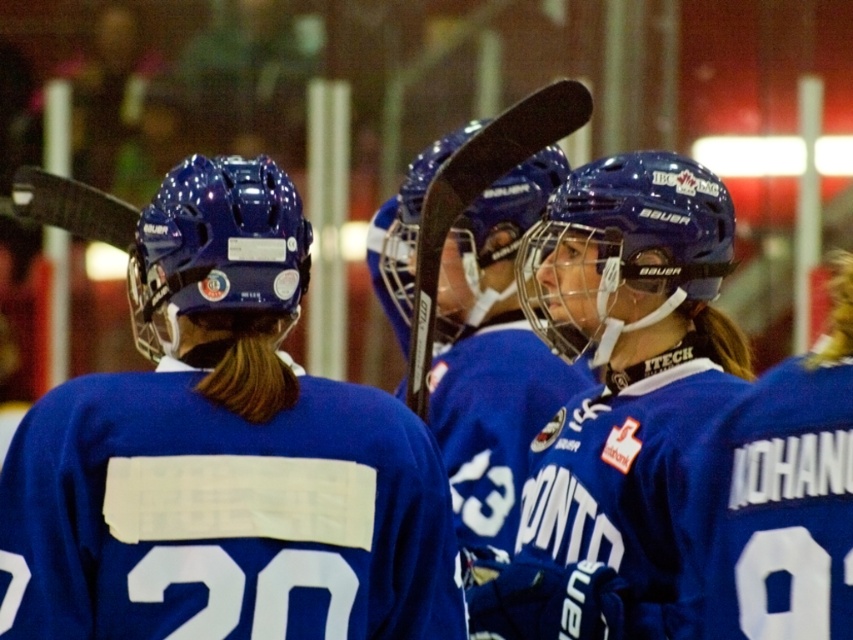
Question: Which object is farther from the camera taking this photo?

Choices:
 (A) matte blue jersey at center
 (B) matte blue helmet at center

Answer: (B)

Question: Considering the real-world distances, which object is closest to the matte blue helmet at center?

Choices:
 (A) matte blue jersey at center
 (B) blue jersey at center

Answer: (A)

Question: Is matte blue jersey at center positioned behind black matte hockey stick at center?

Choices:
 (A) no
 (B) yes

Answer: (A)

Question: Which of the following is the closest to the observer?

Choices:
 (A) (770, 509)
 (B) (514, 124)
 (C) (637, 168)
 (D) (270, 426)

Answer: (A)

Question: Is matte blue jersey at center thinner than black matte hockey stick at center?

Choices:
 (A) no
 (B) yes

Answer: (A)

Question: Can you confirm if matte blue jersey at center is thinner than blue jersey at center?

Choices:
 (A) yes
 (B) no

Answer: (B)